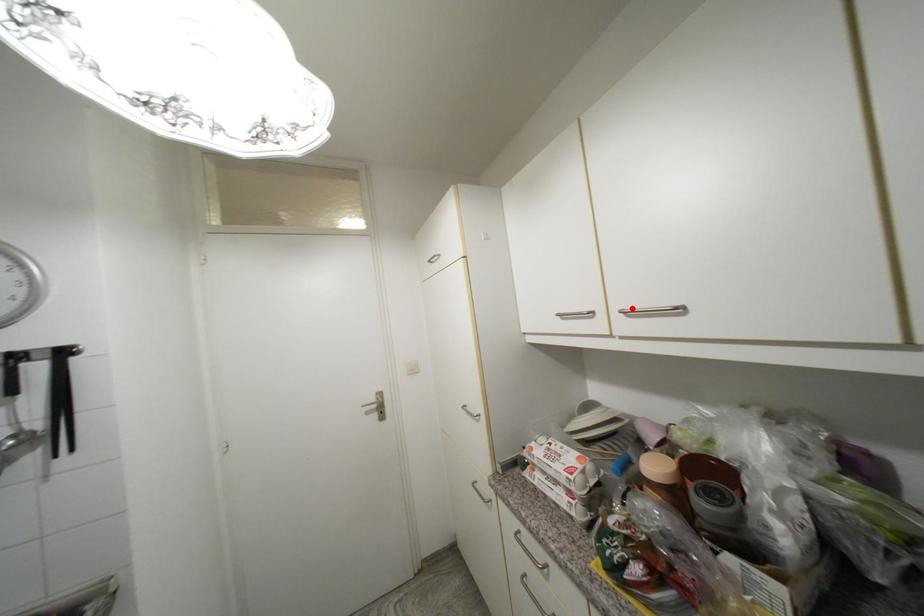
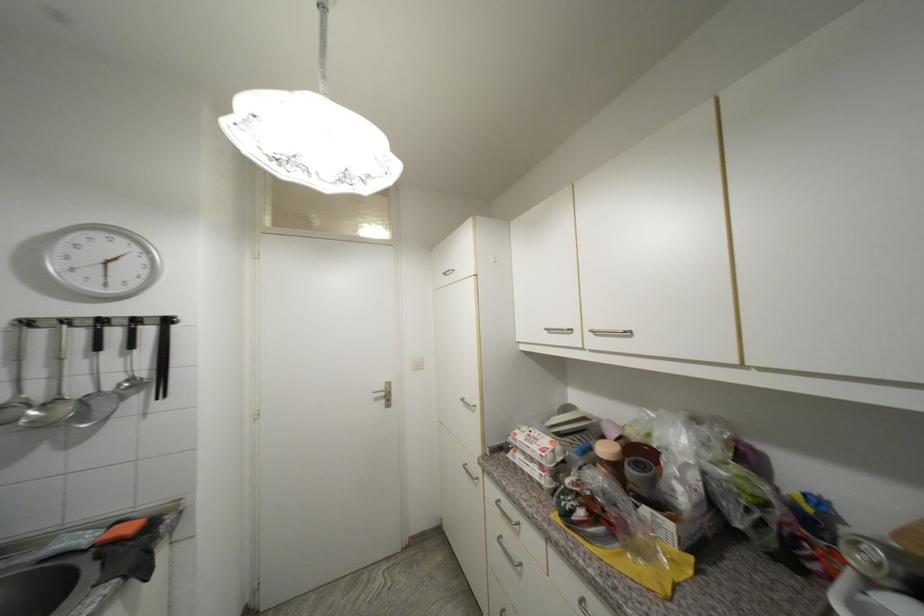
Where in the second image is the point corresponding to the highlighted location from the first image?

(601, 330)